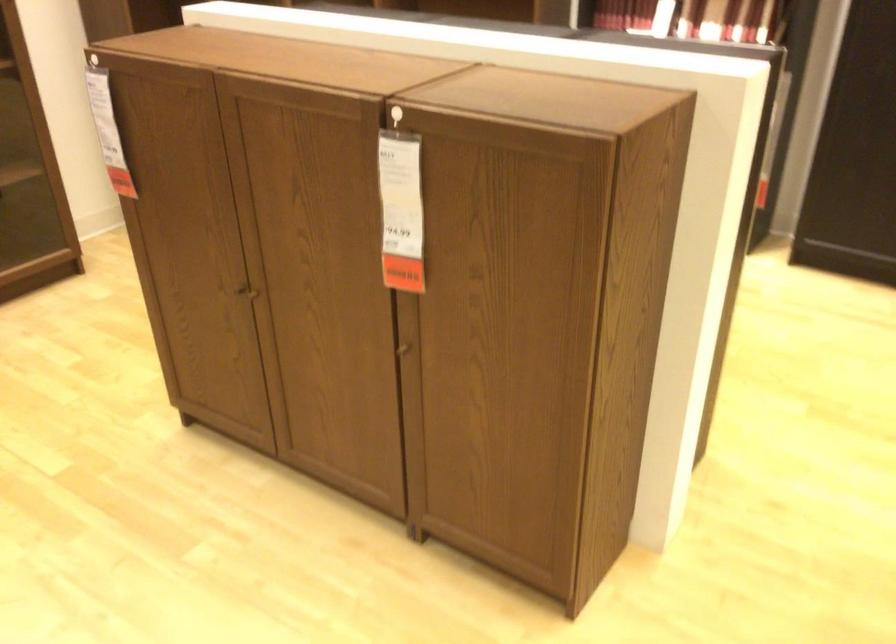
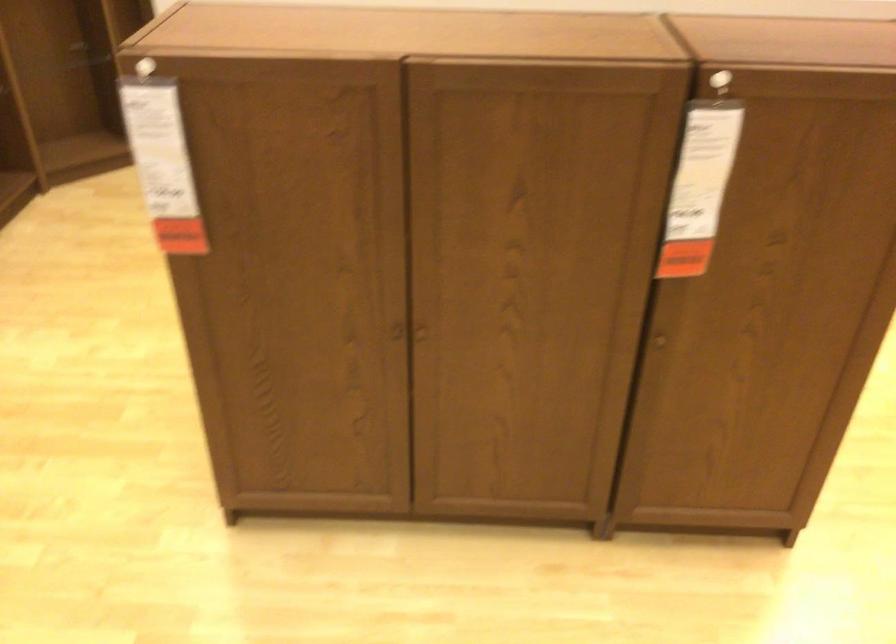
Where in the second image is the point corresponding to [406,194] from the first image?

(702, 169)